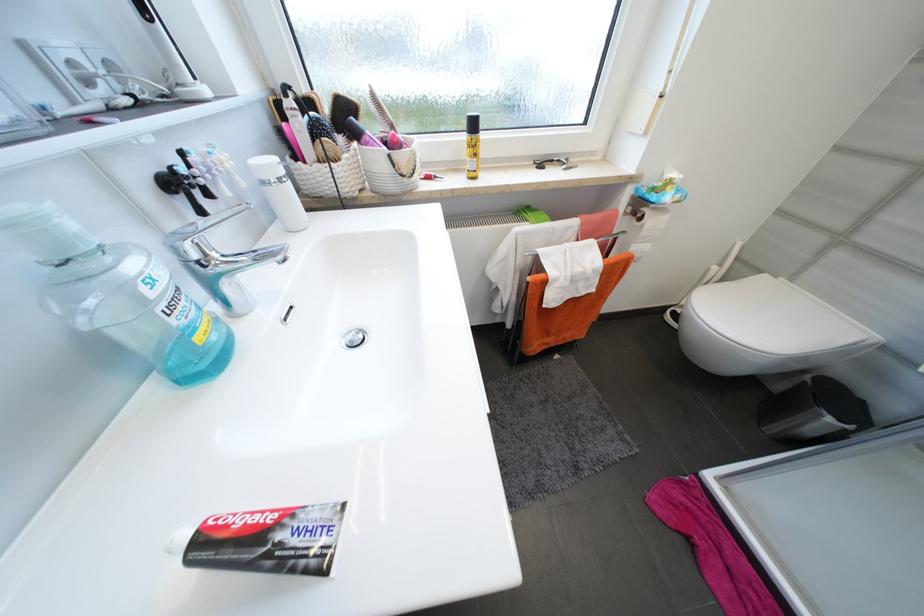
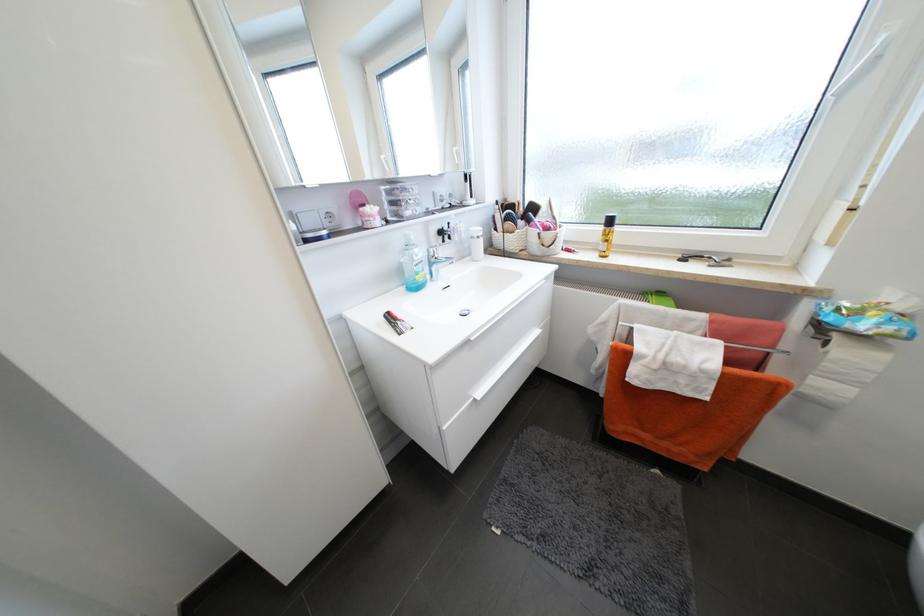
Where in the second image is the point corresponding to point 201,257 from the first image?

(438, 254)